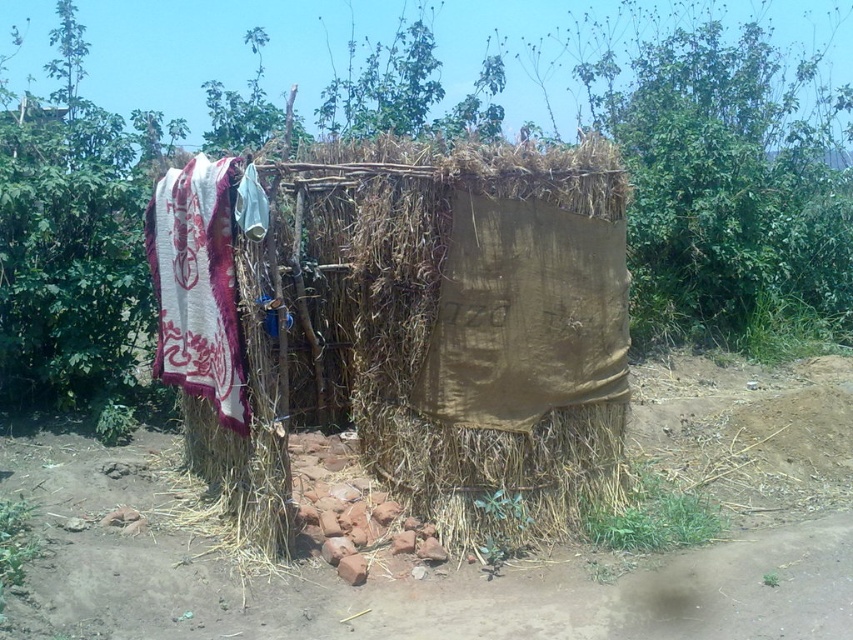
Question: Considering the relative positions of burlap cloth at center and brown fabric at center in the image provided, where is burlap cloth at center located with respect to brown fabric at center?

Choices:
 (A) above
 (B) below

Answer: (A)

Question: Does burlap cloth at center have a larger size compared to brown fabric at center?

Choices:
 (A) yes
 (B) no

Answer: (A)

Question: Which point appears farthest from the camera in this image?

Choices:
 (A) (207, 172)
 (B) (581, 400)
 (C) (76, 467)
 (D) (548, 394)

Answer: (C)

Question: Can you confirm if brown dirt field at lower left is positioned below brown fabric at center?

Choices:
 (A) no
 (B) yes

Answer: (B)

Question: Which of the following is the closest to the observer?

Choices:
 (A) brown dirt field at lower left
 (B) white woven cloth at left

Answer: (A)

Question: Which object appears farthest from the camera in this image?

Choices:
 (A) white woven cloth at left
 (B) brown dirt field at lower left
 (C) brown fabric at center
 (D) burlap cloth at center

Answer: (C)